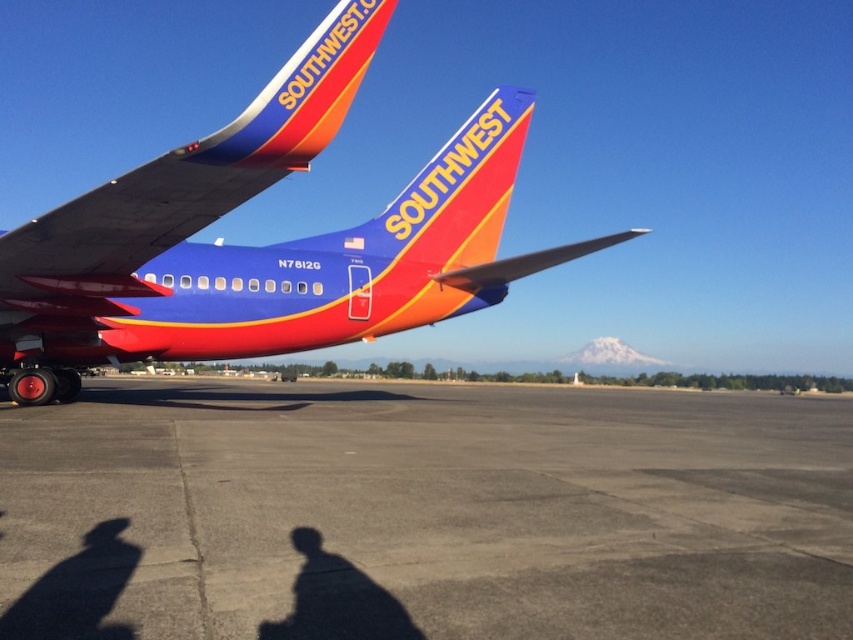
Which of these two, gray asphalt tarmac at center or matte blue airplane at center, stands taller?

With more height is matte blue airplane at center.

Does point (747, 496) come closer to viewer compared to point (450, 164)?

Yes.

Where is `gray asphalt tarmac at center`? The image size is (853, 640). gray asphalt tarmac at center is located at coordinates (424, 513).